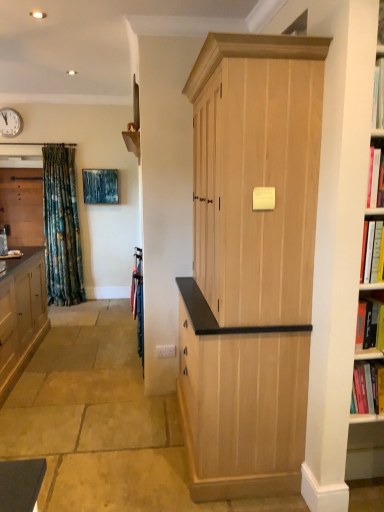
The width and height of the screenshot is (384, 512). I want to click on free location to the left of natural wood cabinet at center, which is counted as the 1th cabinetry, starting from the front, so click(x=109, y=441).